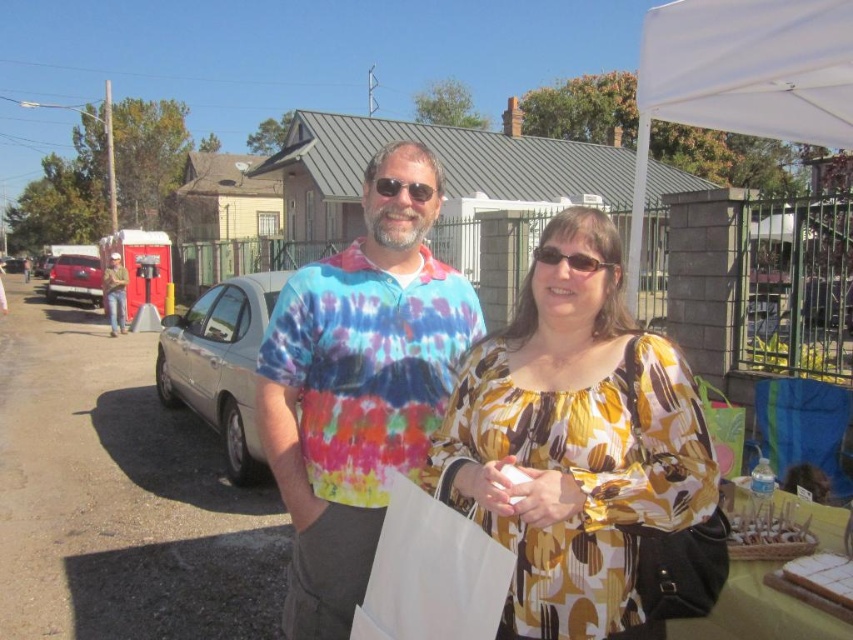
Question: Does yellow printed blouse at center appear on the left side of white fabric canopy at upper right?

Choices:
 (A) yes
 (B) no

Answer: (A)

Question: Is yellow printed blouse at center thinner than brushed metal toilet at left?

Choices:
 (A) no
 (B) yes

Answer: (B)

Question: Which is farther from the matte plastic sunglasses at center?

Choices:
 (A) white fabric canopy at upper right
 (B) silver metallic car at center
 (C) shiny red car at left

Answer: (C)

Question: Which point is farther to the camera?

Choices:
 (A) shiny red car at left
 (B) silver metallic car at center
 (C) brushed metal toilet at left
 (D) matte plastic sunglasses at center

Answer: (A)

Question: Which point is closer to the camera taking this photo?

Choices:
 (A) (430, 198)
 (B) (381, 268)
 (C) (492, 346)

Answer: (C)

Question: Can you confirm if yellow printed blouse at center is thinner than black plastic sunglasses at center?

Choices:
 (A) yes
 (B) no

Answer: (B)